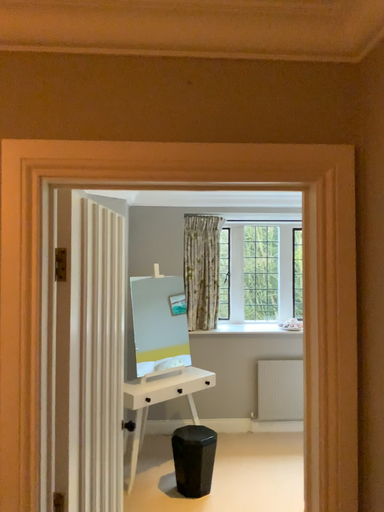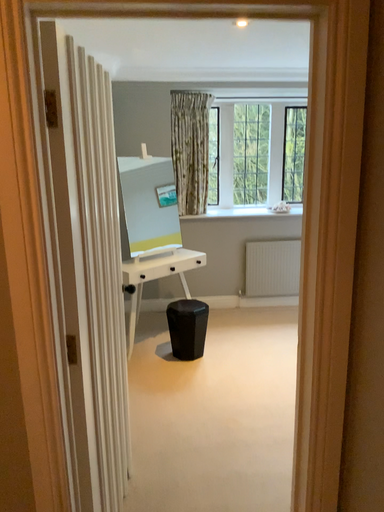
Question: How did the camera likely rotate when shooting the video?

Choices:
 (A) rotated upward
 (B) rotated downward

Answer: (B)